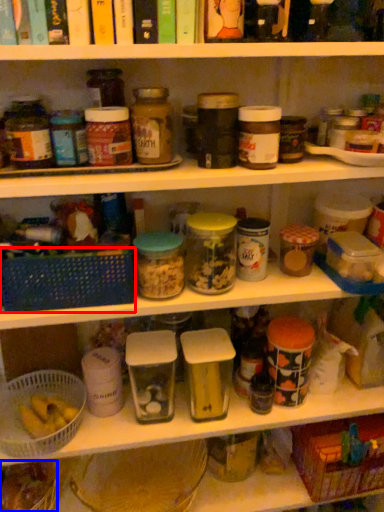
Question: Which object is closer to the camera taking this photo, basket (highlighted by a red box) or food (highlighted by a blue box)?

Choices:
 (A) basket
 (B) food

Answer: (A)